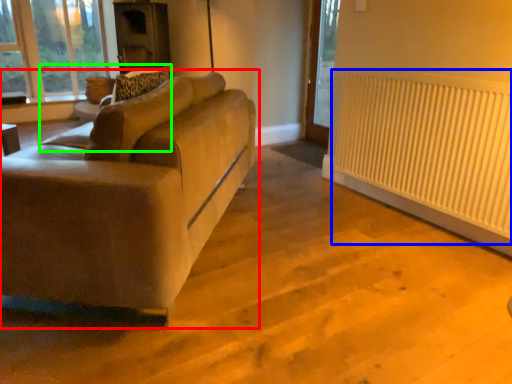
Question: Considering the real-world distances, which object is closest to studio couch (highlighted by a red box)? radiator (highlighted by a blue box) or swivel chair (highlighted by a green box).

Choices:
 (A) radiator
 (B) swivel chair

Answer: (B)